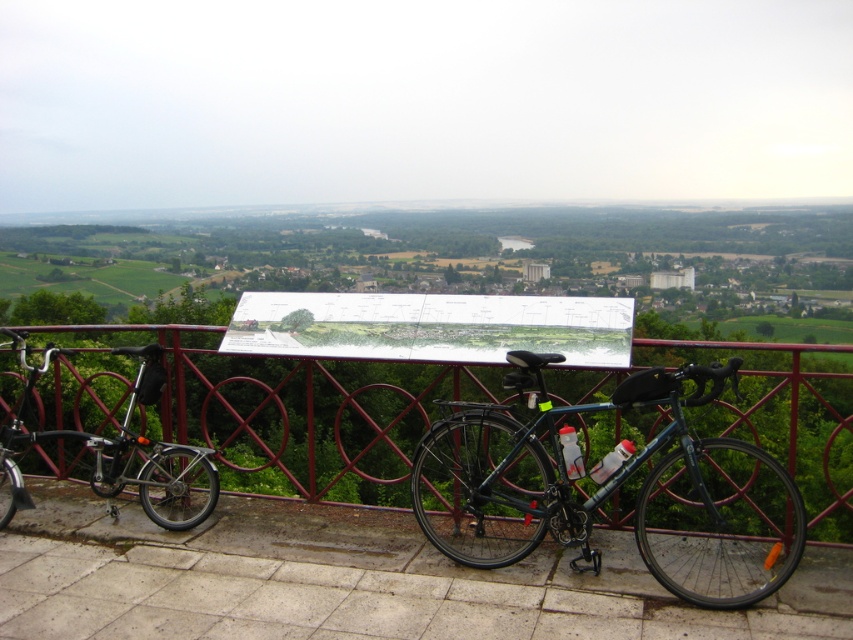
Question: Based on their relative distances, which object is farther from the metallic red fence at center?

Choices:
 (A) shiny black bicycle at left
 (B) shiny dark blue bike at center

Answer: (B)

Question: Can you confirm if shiny dark blue bike at center is wider than shiny black bicycle at left?

Choices:
 (A) yes
 (B) no

Answer: (A)

Question: Which object is positioned farthest from the metallic red fence at center?

Choices:
 (A) shiny dark blue bike at center
 (B) shiny black bicycle at left

Answer: (A)

Question: Which object is the farthest from the shiny dark blue bike at center?

Choices:
 (A) metallic red fence at center
 (B) shiny black bicycle at left

Answer: (A)

Question: Is metallic red fence at center behind shiny dark blue bike at center?

Choices:
 (A) no
 (B) yes

Answer: (B)

Question: Is metallic red fence at center below shiny dark blue bike at center?

Choices:
 (A) yes
 (B) no

Answer: (A)